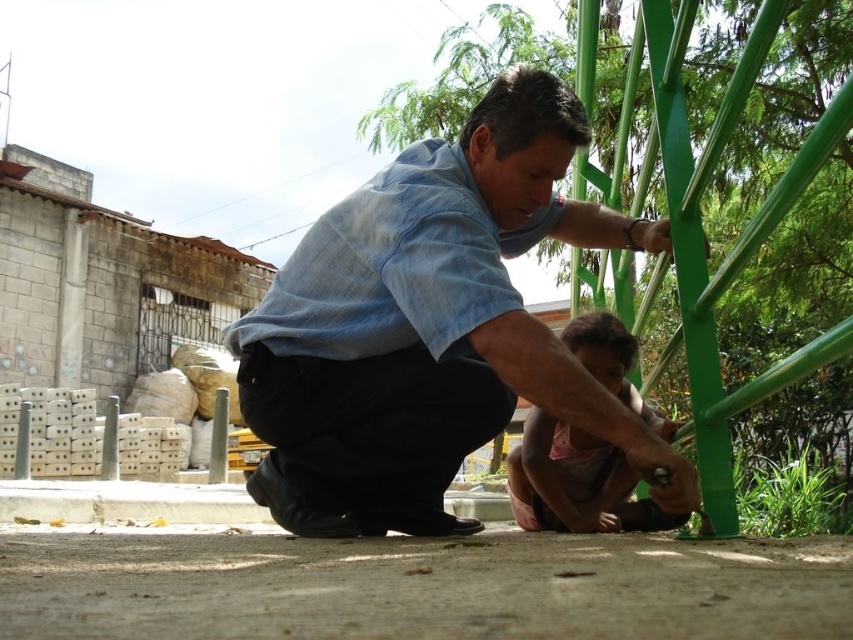
You are a photographer trying to capture a candid shot of both the blue denim shirt at center and the pink fabric shirt at lower center. Since you want to ensure both subjects are in focus, you need to know their vertical positions. Which shirt is positioned higher?

The blue denim shirt at center is above the pink fabric shirt at lower center, so the blue denim shirt at center is higher.

You are a photographer trying to capture a candid shot of both the blue denim shirt at center and the pink fabric shirt at lower center. The camera you are using has a maximum focus range of 28 inches. Can you capture both subjects in focus without moving the camera or the subjects?

The blue denim shirt at center is 29.00 inches away from the pink fabric shirt at lower center. Since the camera can only focus within 28 inches, the distance between them exceeds the maximum focus range. Therefore, you cannot capture both subjects in focus without adjusting the camera or moving the subjects.

You are standing in front of the green metal structure and want to reach both the point at (486,280) and the point at (653,420). Which point should you reach for first to minimize the distance traveled?

You should reach for point (486,280) first because it is closer to you than point (653,420).